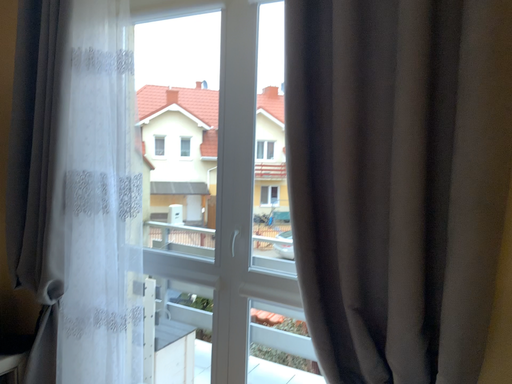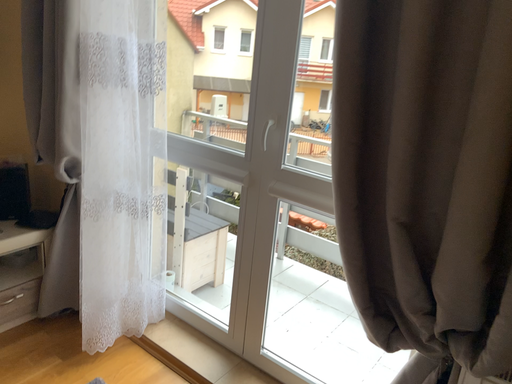
Question: Which way did the camera rotate in the video?

Choices:
 (A) rotated upward
 (B) rotated downward

Answer: (B)